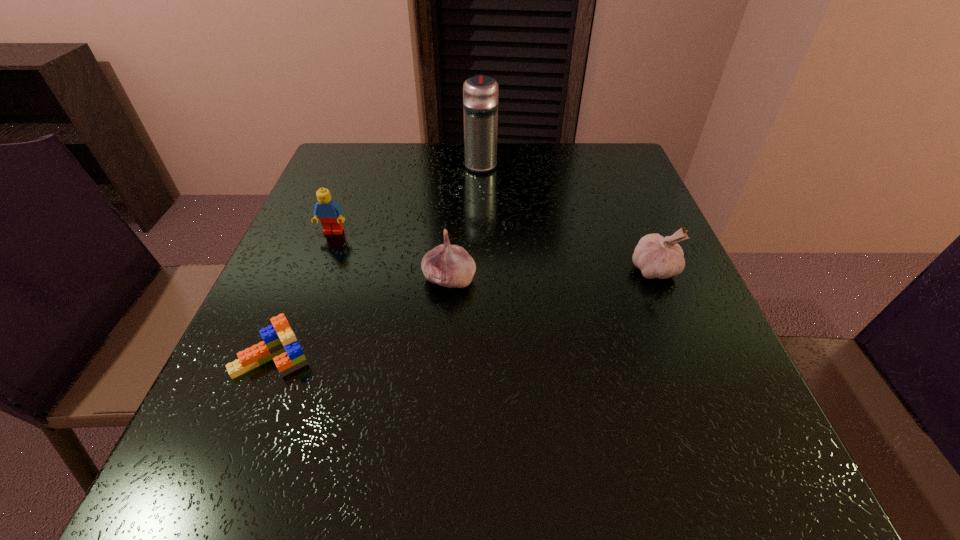
I want to click on the tallest object, so click(480, 93).

The height and width of the screenshot is (540, 960). What are the coordinates of `thermos bottle` in the screenshot? It's located at (480, 93).

Where is `the left garlic`? the left garlic is located at coordinates (447, 265).

At what (x,y) coordinates should I click in order to perform the action: click on the rightmost object. Please return your answer as a coordinate pair (x, y). This screenshot has height=540, width=960. Looking at the image, I should click on (657, 257).

Locate an element on the screen. This screenshot has height=540, width=960. the taller Lego is located at coordinates click(326, 209).

Image resolution: width=960 pixels, height=540 pixels. Identify the location of the farther Lego. (326, 209).

The height and width of the screenshot is (540, 960). What are the coordinates of `the nearest object` in the screenshot? It's located at (279, 343).

In order to click on the shortest object in this screenshot , I will do `click(279, 343)`.

This screenshot has height=540, width=960. I want to click on vacant region located with a handle on the side of the tallest object, so click(x=481, y=143).

Where is `vacant space located 0.130m on the back of the left garlic`? The image size is (960, 540). vacant space located 0.130m on the back of the left garlic is located at coordinates (453, 223).